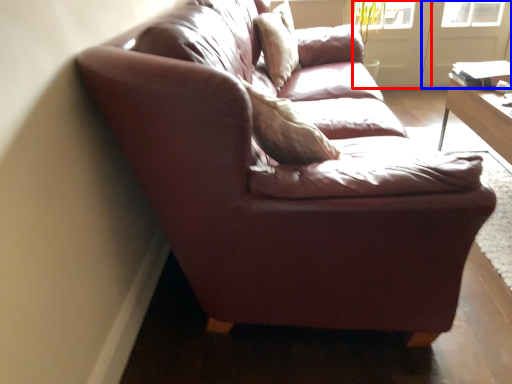
Question: Which object appears farthest to the camera in this image, screen door (highlighted by a red box) or screen door (highlighted by a blue box)?

Choices:
 (A) screen door
 (B) screen door

Answer: (A)